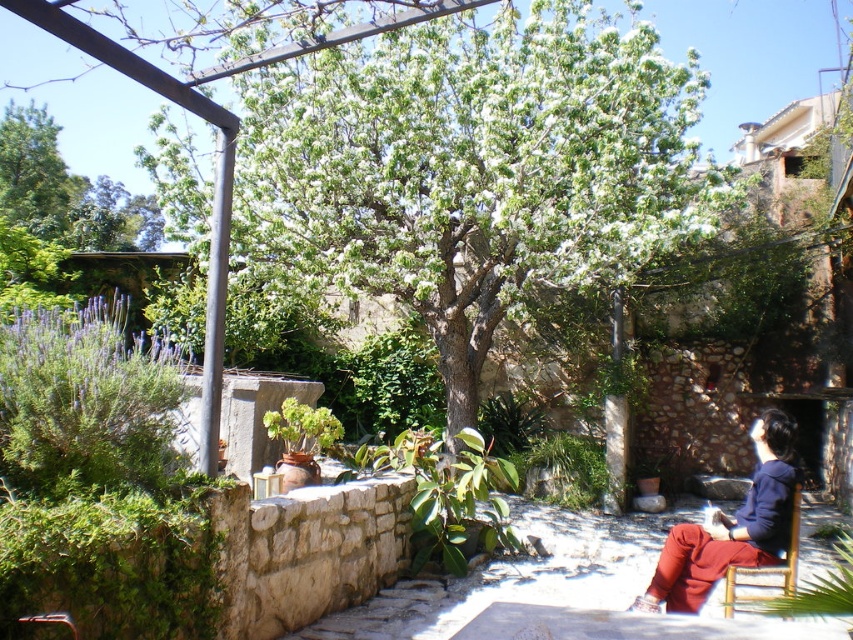
You are a gardener holding a watering can and need to water the green leafy tree at center and the wooden chair at lower right. If you can carry the watering can for up to 5 meters without spilling, can you water both objects without needing to refill?

The green leafy tree at center and wooden chair at lower right are 4.52 meters apart from each other. Since the gardener can carry the watering can for up to 5 meters, they can water both objects without needing to refill as the distance between them is within the 5 meter limit.

You are standing at the point labeled point (474, 170) in the garden. What is the nearest object to you?

The nearest object to you is the green leafy tree at center, as the point (474, 170) directly indicates its location.